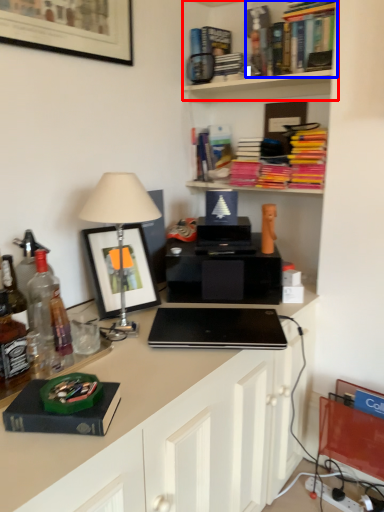
Question: Which of the following is the closest to the observer, shelf (highlighted by a red box) or book (highlighted by a blue box)?

Choices:
 (A) shelf
 (B) book

Answer: (A)